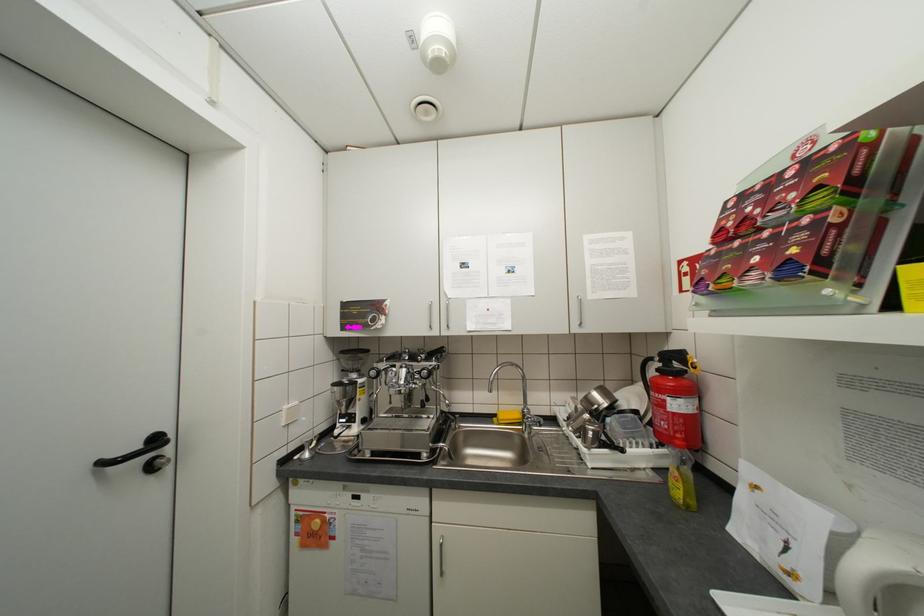
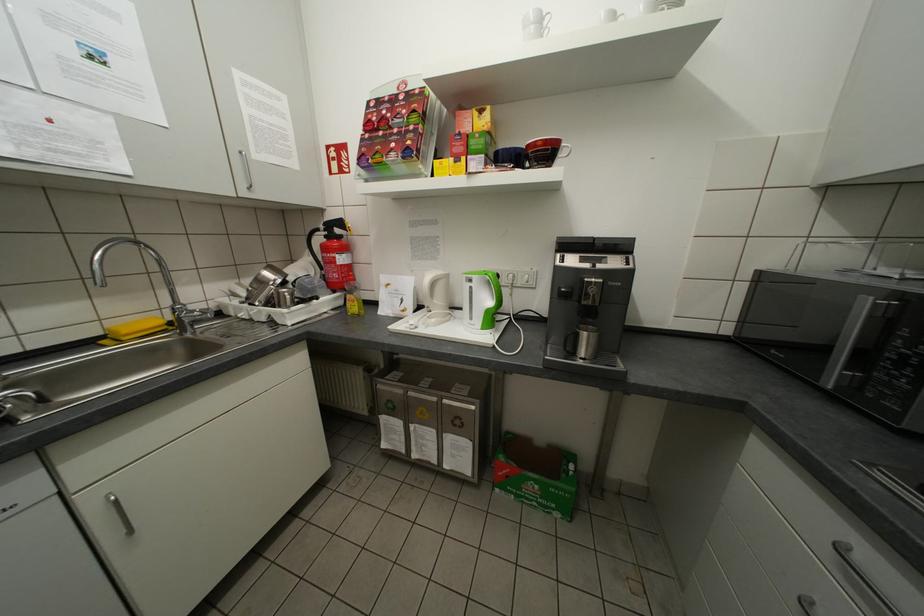
In the second image, find the point that corresponds to point 584,323 in the first image.

(251, 185)